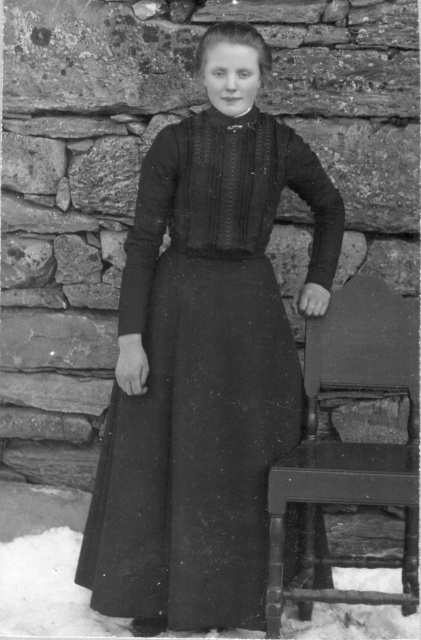
The image size is (421, 640). What do you see at coordinates (204, 376) in the screenshot?
I see `black matte dress at center` at bounding box center [204, 376].

Does black matte dress at center appear on the right side of white powdery snow at lower left?

Yes, black matte dress at center is to the right of white powdery snow at lower left.

Which is in front, point (229, 554) or point (55, 545)?

Point (229, 554) is in front.

Image resolution: width=421 pixels, height=640 pixels. Identify the location of black matte dress at center. point(204,376).

Can you confirm if dark wood chair at right is wider than white powdery snow at lower left?

No.

Consider the image. Measure the distance between point (x=389, y=312) and camera.

Point (x=389, y=312) and camera are 8.80 feet apart from each other.

Find the location of a particular element. The width and height of the screenshot is (421, 640). dark wood chair at right is located at coordinates (349, 448).

Can you confirm if black matte dress at center is taller than dark wood chair at right?

Indeed, black matte dress at center has a greater height compared to dark wood chair at right.

Which is in front, point (152, 230) or point (378, 593)?

Positioned in front is point (378, 593).

Between point (242, 356) and point (354, 476), which one is positioned in front?

Point (354, 476)

Locate an element on the screen. The width and height of the screenshot is (421, 640). black matte dress at center is located at coordinates (204, 376).